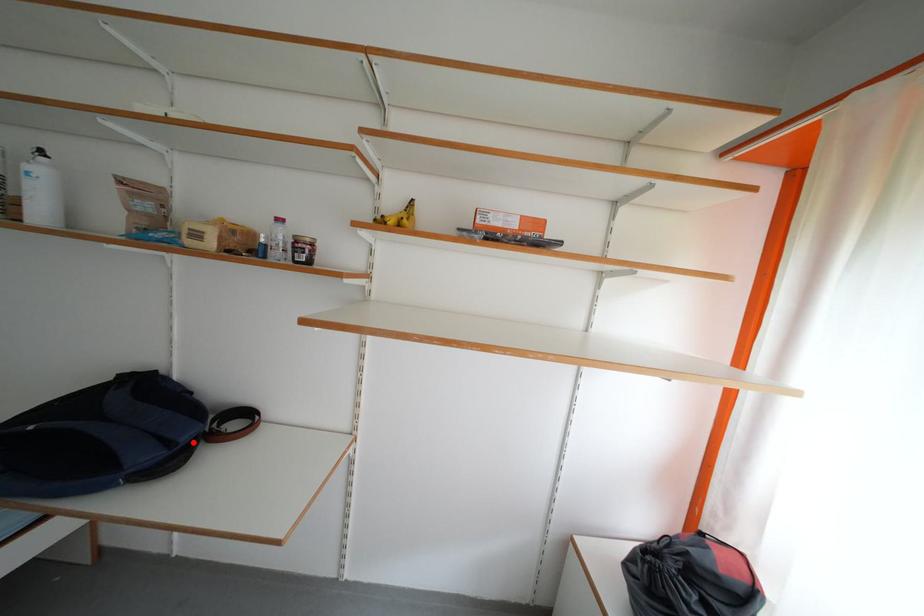
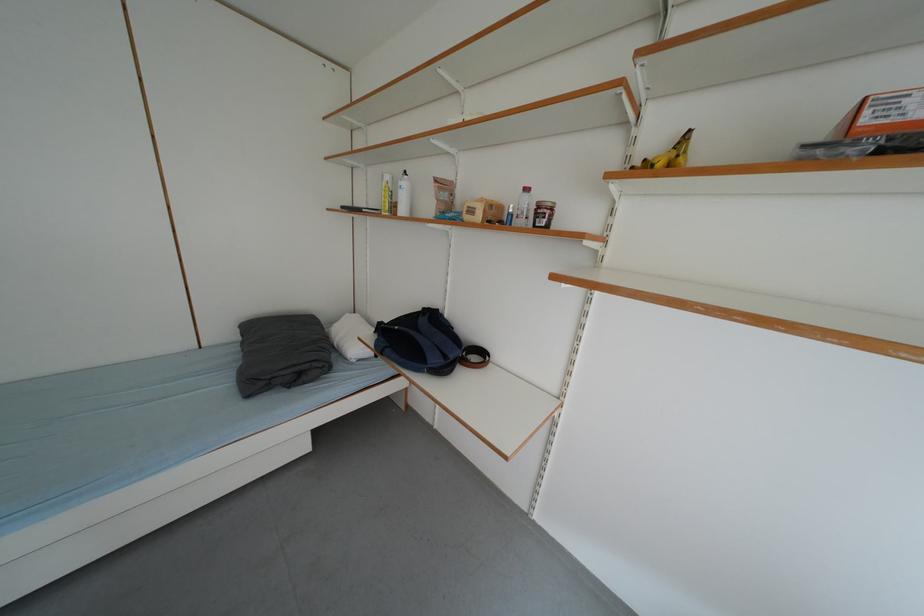
In the second image, find the point that corresponds to the highlighted location in the first image.

(460, 360)